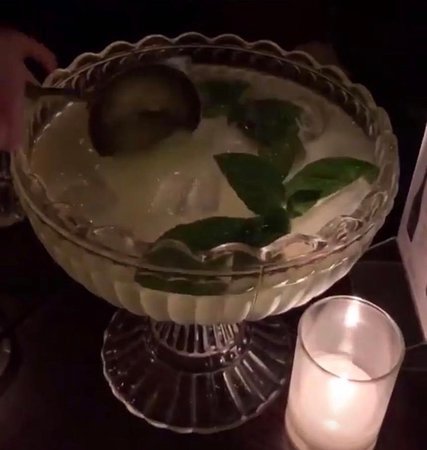
This screenshot has width=427, height=450. What are the coordinates of `glass bowl` in the screenshot? It's located at (166, 280).